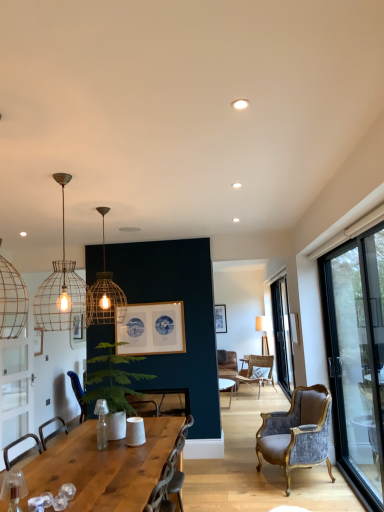
Identify the location of vacant area situated below metal wire pendant light at upper left, marked as the first lamp in a front-to-back arrangement (from a real-world perspective). The height and width of the screenshot is (512, 384). [61, 478].